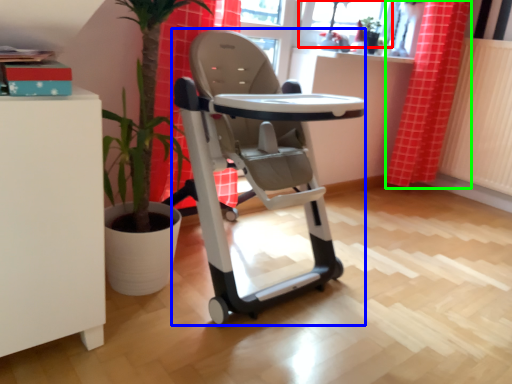
Question: Which object is the farthest from window screen (highlighted by a red box)? Choose among these: baby carriage (highlighted by a blue box) or curtain (highlighted by a green box).

Choices:
 (A) baby carriage
 (B) curtain

Answer: (A)